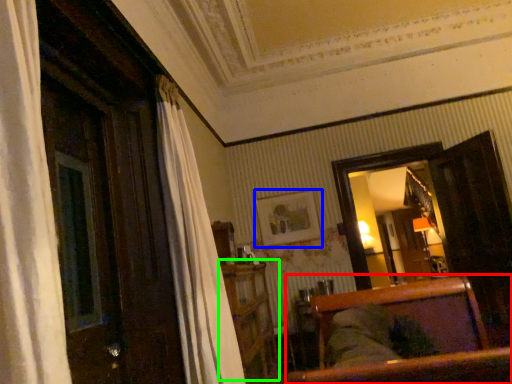
Question: Which object is positioned farthest from furniture (highlighted by a red box)? Select from picture frame (highlighted by a blue box) and dresser (highlighted by a green box).

Choices:
 (A) picture frame
 (B) dresser

Answer: (A)